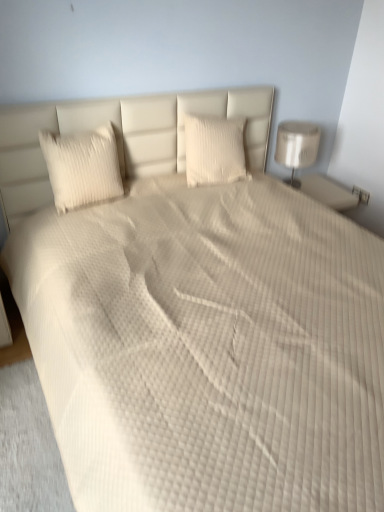
Question: Considering the relative positions of white textured pillow at center, arranged as the first pillow when viewed from the right, and white glossy lamp at right in the image provided, is white textured pillow at center, arranged as the first pillow when viewed from the right, to the left or to the right of white glossy lamp at right?

Choices:
 (A) right
 (B) left

Answer: (B)

Question: Considering the positions of point (205, 148) and point (306, 138), is point (205, 148) closer or farther from the camera than point (306, 138)?

Choices:
 (A) farther
 (B) closer

Answer: (B)

Question: Based on their relative distances, which object is farther from the white textured pillow at left, acting as the first pillow starting from the left?

Choices:
 (A) white glossy lamp at right
 (B) white textured pillow at center, which ranks as the 2th pillow in left-to-right order

Answer: (A)

Question: Estimate the real-world distances between objects in this image. Which object is farther from the white textured pillow at left, marked as the 2th pillow in a right-to-left arrangement?

Choices:
 (A) white textured pillow at center, which ranks as the 2th pillow in left-to-right order
 (B) white glossy lamp at right

Answer: (B)